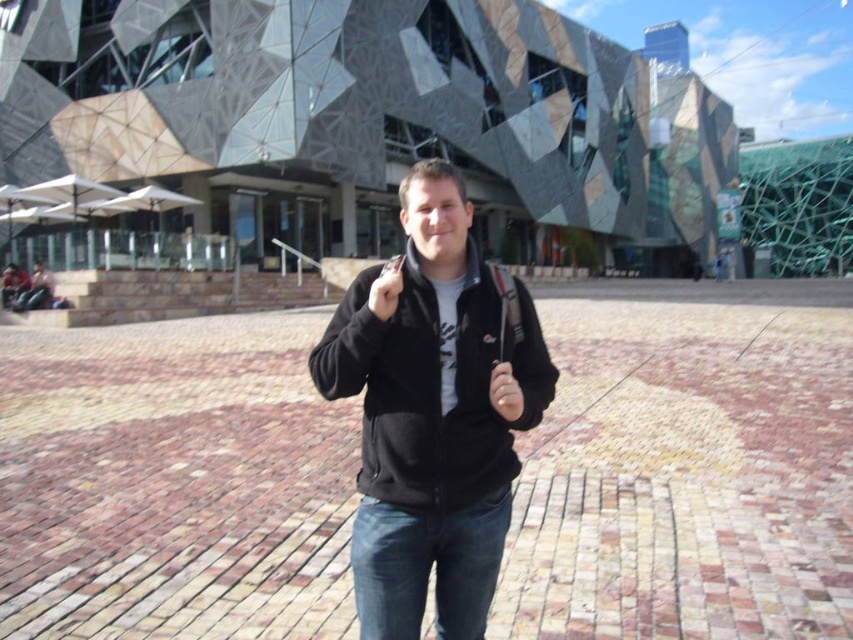
Question: Considering the real-world distances, which object is farthest from the brick pavement at center?

Choices:
 (A) denim at center
 (B) matte black hand at center
 (C) matte black phone at center
 (D) black fleece jacket at center

Answer: (C)

Question: Can you confirm if denim at center is positioned above matte black phone at center?

Choices:
 (A) yes
 (B) no

Answer: (B)

Question: Is black fleece jacket at center positioned before denim at center?

Choices:
 (A) yes
 (B) no

Answer: (B)

Question: Which object is the closest to the black fleece jacket at center?

Choices:
 (A) matte black hand at center
 (B) brick pavement at center

Answer: (A)

Question: Can you confirm if brick pavement at center is positioned to the right of denim at center?

Choices:
 (A) yes
 (B) no

Answer: (A)

Question: Estimate the real-world distances between objects in this image. Which object is farther from the black fleece jacket at center?

Choices:
 (A) brick pavement at center
 (B) matte black hand at center

Answer: (A)